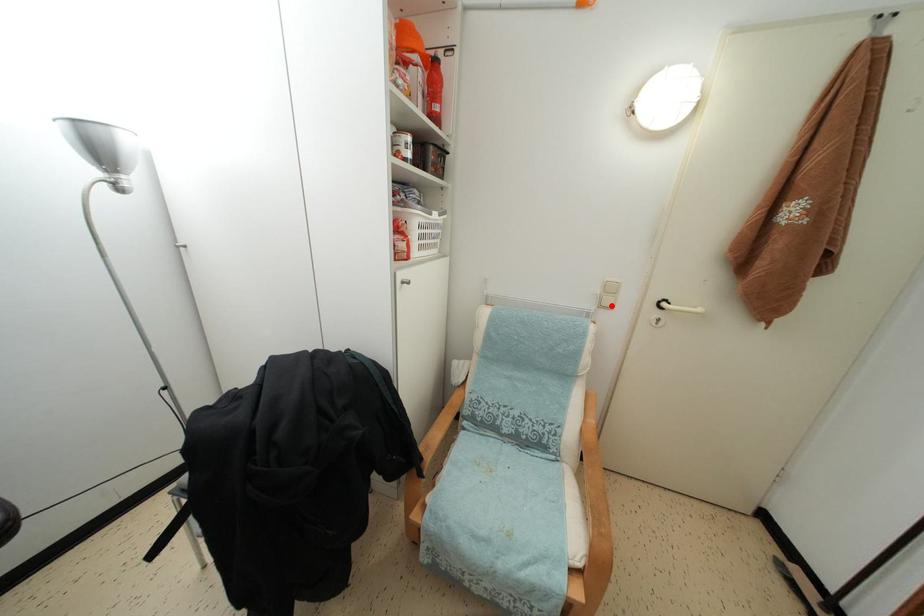
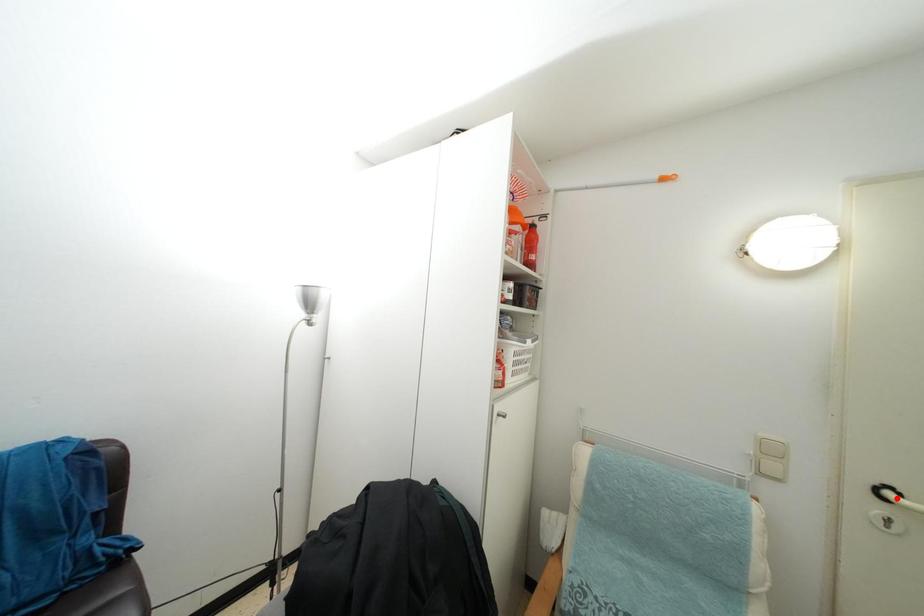
I am providing you with two images of the same scene from different viewpoints. A red point is marked on the first image and another point is marked on the second image. Are the points marked in image1 and image2 representing the same 3D position?

No